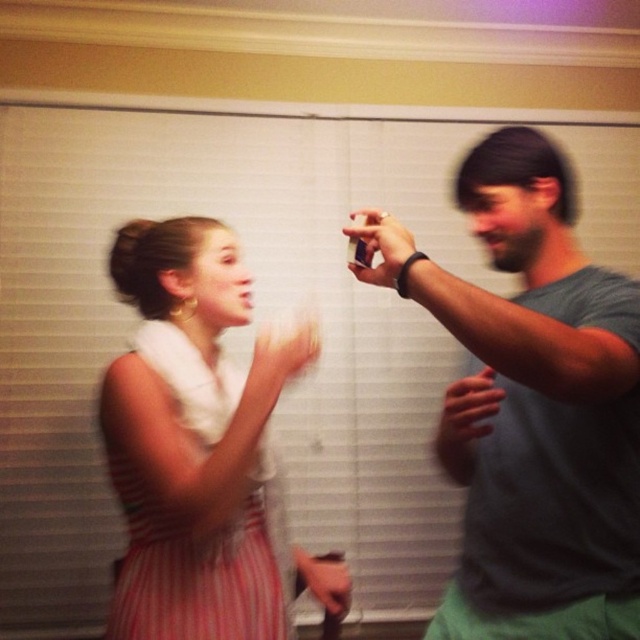
Who is more distant from viewer, [506,188] or [250,499]?

The point [250,499] is behind.

Where is `gray matte t-shirt at upper right`? This screenshot has height=640, width=640. gray matte t-shirt at upper right is located at coordinates (532, 406).